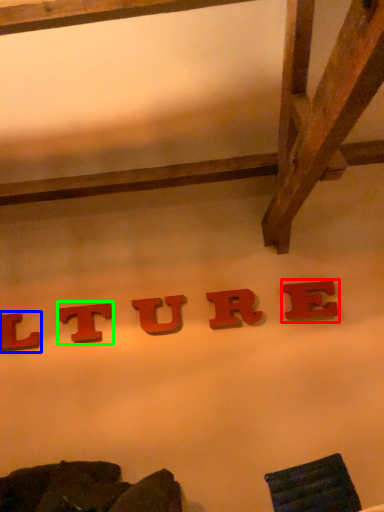
Question: Which object is positioned farthest from letter (highlighted by a red box)? Select from letter (highlighted by a blue box) and letter (highlighted by a green box).

Choices:
 (A) letter
 (B) letter

Answer: (A)